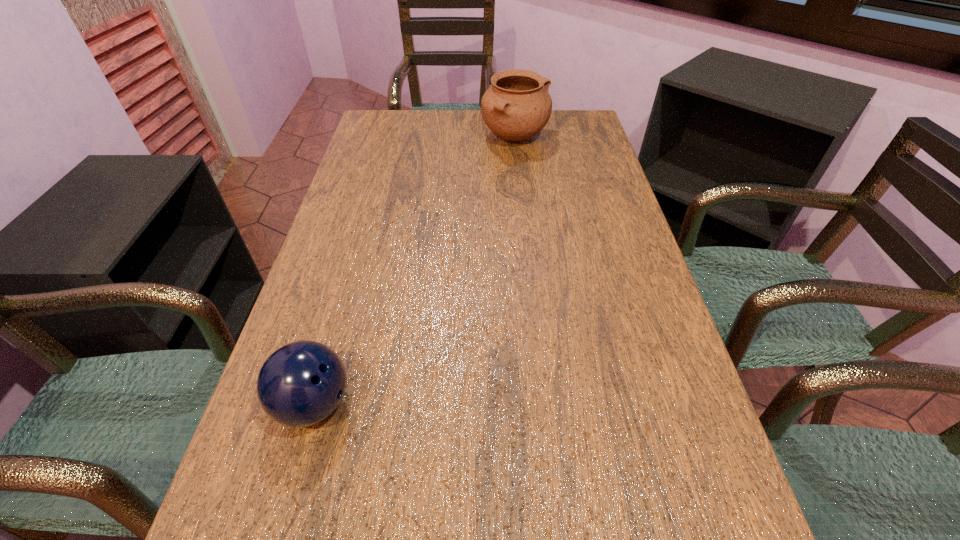
In order to click on the right object in this screenshot , I will do `click(517, 106)`.

I want to click on pottery, so click(517, 106).

Identify the location of bowling ball. (300, 384).

At what (x,y) coordinates should I click in order to perform the action: click on the nearer object. Please return your answer as a coordinate pair (x, y). This screenshot has height=540, width=960. Looking at the image, I should click on (300, 384).

Where is `free space located on the left of the taller object`? This screenshot has width=960, height=540. free space located on the left of the taller object is located at coordinates (463, 138).

I want to click on vacant space located on the surface of the shorter object near the finger holes, so click(x=490, y=404).

At what (x,y) coordinates should I click in order to perform the action: click on object present at the far edge. Please return your answer as a coordinate pair (x, y). Looking at the image, I should click on (517, 106).

Find the location of a particular element. object positioned at the left edge is located at coordinates (300, 384).

Where is `object positioned at the right edge`? Image resolution: width=960 pixels, height=540 pixels. object positioned at the right edge is located at coordinates (517, 106).

Locate an element on the screen. Image resolution: width=960 pixels, height=540 pixels. object located at the far right corner is located at coordinates (517, 106).